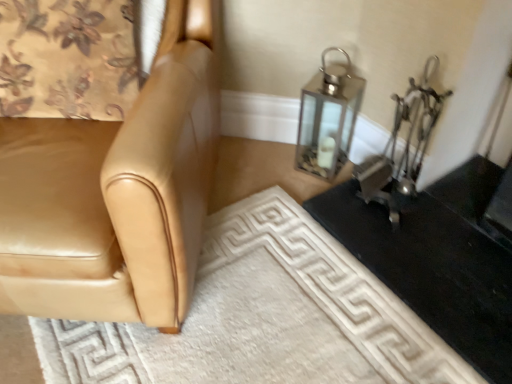
The image size is (512, 384). What are the coordinates of `free region under black glossy table at lower right (from a real-world perspective)` in the screenshot? It's located at (462, 250).